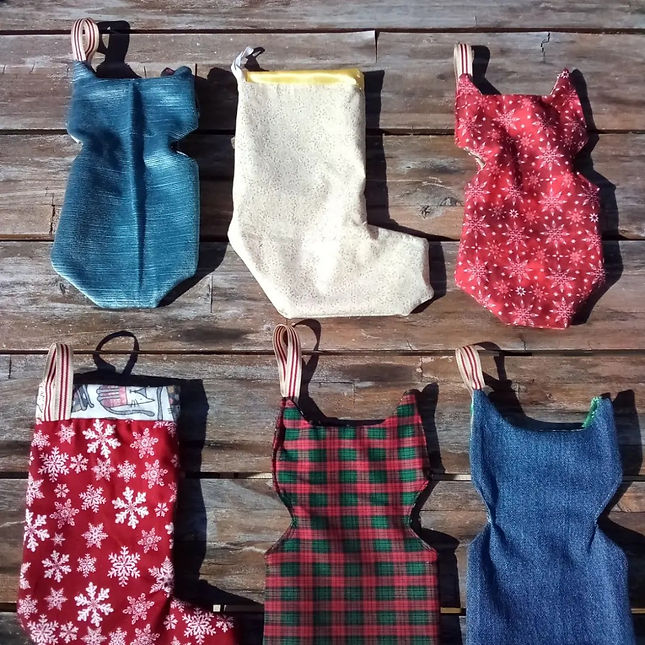
Image resolution: width=645 pixels, height=645 pixels. I want to click on stocking hanger, so click(81, 46), click(64, 366), click(299, 362), click(464, 369), click(461, 62), click(240, 57).